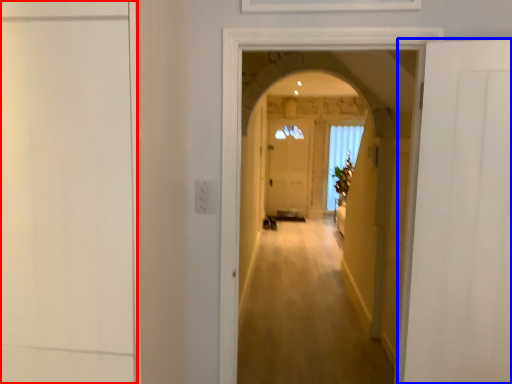
Question: Among these objects, which one is nearest to the camera, door (highlighted by a red box) or door (highlighted by a blue box)?

Choices:
 (A) door
 (B) door

Answer: (A)